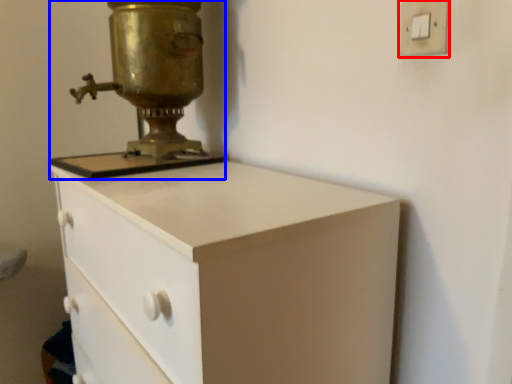
Question: Among these objects, which one is nearest to the camera, light switch (highlighted by a red box) or sewing machine (highlighted by a blue box)?

Choices:
 (A) light switch
 (B) sewing machine

Answer: (A)